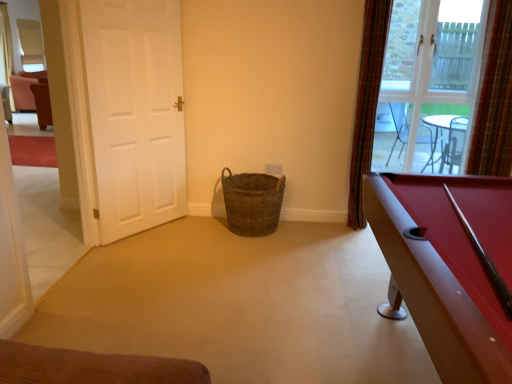
The image size is (512, 384). What do you see at coordinates (429, 85) in the screenshot?
I see `clear glass window at upper right` at bounding box center [429, 85].

Where is `white matte door at left`? The image size is (512, 384). white matte door at left is located at coordinates tap(130, 116).

Where is `plaid fabric curtain at upper right, the first curtain viewed from the right`? The width and height of the screenshot is (512, 384). plaid fabric curtain at upper right, the first curtain viewed from the right is located at coordinates (494, 98).

This screenshot has height=384, width=512. Identify the location of clear glass window at upper right. (429, 85).

Is white matte door at left positioned beyond the bounds of brown woven basket at center?

Yes, white matte door at left is outside of brown woven basket at center.

Considering the sizes of objects white matte door at left and brown woven basket at center in the image provided, who is bigger, white matte door at left or brown woven basket at center?

Bigger between the two is white matte door at left.

Would you say white matte door at left is a long distance from brown woven basket at center?

No, white matte door at left is in close proximity to brown woven basket at center.

Consider the image. In the image, is white matte door at left on the left side or the right side of plaid fabric curtain at right, which appears as the 1th curtain when viewed from the left?

white matte door at left is positioned on plaid fabric curtain at right, which appears as the 1th curtain when viewed from the left,'s left side.

Between white matte door at left and plaid fabric curtain at right, which appears as the 1th curtain when viewed from the left, which one has more height?

plaid fabric curtain at right, which appears as the 1th curtain when viewed from the left, is taller.

From a real-world perspective, is white matte door at left physically above plaid fabric curtain at right, which is counted as the 2th curtain, starting from the right?

No, from a real-world perspective, white matte door at left is not on top of plaid fabric curtain at right, which is counted as the 2th curtain, starting from the right.

Is white matte door at left in front of plaid fabric curtain at right, which appears as the 1th curtain when viewed from the left?

Yes, white matte door at left is in front of plaid fabric curtain at right, which appears as the 1th curtain when viewed from the left.

Is plaid fabric curtain at right, which appears as the 1th curtain when viewed from the left, oriented away from rubberized red pool table at right?

plaid fabric curtain at right, which appears as the 1th curtain when viewed from the left, does not have its back to rubberized red pool table at right.

Which object is more forward, plaid fabric curtain at right, which is counted as the 2th curtain, starting from the right, or rubberized red pool table at right?

rubberized red pool table at right is closer to the camera.

Is white matte door at left to the left of rubberized red pool table at right from the viewer's perspective?

Correct, you'll find white matte door at left to the left of rubberized red pool table at right.

What's the angular difference between white matte door at left and rubberized red pool table at right's facing directions?

white matte door at left and rubberized red pool table at right are facing 147 degrees away from each other.

Which is in front, white matte door at left or rubberized red pool table at right?

Positioned in front is rubberized red pool table at right.

Consider the image. Is white matte door at left inside the boundaries of rubberized red pool table at right, or outside?

The correct answer is: outside.

Looking at this image, does rubberized red pool table at right have a smaller size compared to clear glass window at upper right?

Incorrect, rubberized red pool table at right is not smaller in size than clear glass window at upper right.

Between rubberized red pool table at right and clear glass window at upper right, which one appears on the right side from the viewer's perspective?

From the viewer's perspective, clear glass window at upper right appears more on the right side.

Considering the relative sizes of rubberized red pool table at right and clear glass window at upper right in the image provided, is rubberized red pool table at right shorter than clear glass window at upper right?

Yes, rubberized red pool table at right is shorter than clear glass window at upper right.

Can you tell me how much rubberized red pool table at right and clear glass window at upper right differ in facing direction?

89.9 degrees separate the facing orientations of rubberized red pool table at right and clear glass window at upper right.

From a real-world perspective, which object stands above the other?

rubberized red pool table at right.

Image resolution: width=512 pixels, height=384 pixels. I want to click on basket that appears below the rubberized red pool table at right (from a real-world perspective), so click(x=252, y=202).

Which is in front, point (231, 187) or point (508, 328)?

The point (508, 328) is in front.

Is brown woven basket at center spatially inside rubberized red pool table at right, or outside of it?

brown woven basket at center lies outside rubberized red pool table at right.

Consider the image. From a real-world perspective, is clear glass window at upper right physically above white matte door at left?

Yes, from a real-world perspective, clear glass window at upper right is over white matte door at left

Is point (449, 4) farther from viewer compared to point (102, 170)?

Yes.

Does clear glass window at upper right appear on the left side of white matte door at left?

Incorrect, clear glass window at upper right is not on the left side of white matte door at left.

Is clear glass window at upper right positioned beyond the bounds of white matte door at left?

Yes, clear glass window at upper right is not within white matte door at left.

This screenshot has width=512, height=384. Identify the location of door in front of the brown woven basket at center. (130, 116).

In the image, there is a plaid fabric curtain at right, which appears as the 1th curtain when viewed from the left. Where is `door below it (from the image's perspective)`? door below it (from the image's perspective) is located at coordinates (130, 116).

When comparing their distances from rubberized red pool table at right, does clear glass window at upper right or brown woven basket at center seem closer?

Among the two, brown woven basket at center is located nearer to rubberized red pool table at right.

In the scene shown: Estimate the real-world distances between objects in this image. Which object is further from brown woven basket at center, plaid fabric curtain at upper right, the first curtain viewed from the right, or rubberized red pool table at right?

plaid fabric curtain at upper right, the first curtain viewed from the right, is further to brown woven basket at center.

Which object lies nearer to the anchor point rubberized red pool table at right, brown woven basket at center or plaid fabric curtain at right, which is counted as the 2th curtain, starting from the right?

Based on the image, brown woven basket at center appears to be nearer to rubberized red pool table at right.

Looking at the image, which one is located closer to clear glass window at upper right, white matte door at left or plaid fabric curtain at upper right, the first curtain viewed from the right?

Among the two, plaid fabric curtain at upper right, the first curtain viewed from the right, is located nearer to clear glass window at upper right.

Estimate the real-world distances between objects in this image. Which object is further from plaid fabric curtain at upper right, which is the second curtain from left to right, rubberized red pool table at right or plaid fabric curtain at right, which appears as the 1th curtain when viewed from the left?

rubberized red pool table at right.

Estimate the real-world distances between objects in this image. Which object is further from brown woven basket at center, plaid fabric curtain at upper right, which is the second curtain from left to right, or clear glass window at upper right?

plaid fabric curtain at upper right, which is the second curtain from left to right, is further to brown woven basket at center.

Which object lies nearer to the anchor point plaid fabric curtain at upper right, the first curtain viewed from the right, clear glass window at upper right or brown woven basket at center?

clear glass window at upper right lies closer to plaid fabric curtain at upper right, the first curtain viewed from the right, than the other object.

Based on the photo, which object lies nearer to the anchor point clear glass window at upper right, plaid fabric curtain at upper right, the first curtain viewed from the right, or white matte door at left?

Based on the image, plaid fabric curtain at upper right, the first curtain viewed from the right, appears to be nearer to clear glass window at upper right.

The height and width of the screenshot is (384, 512). I want to click on curtain situated between brown woven basket at center and clear glass window at upper right from left to right, so click(x=367, y=103).

The image size is (512, 384). What are the coordinates of `door between rubberized red pool table at right and plaid fabric curtain at right, which is counted as the 2th curtain, starting from the right, along the z-axis` in the screenshot? It's located at (130, 116).

Image resolution: width=512 pixels, height=384 pixels. Identify the location of window screen between brown woven basket at center and plaid fabric curtain at upper right, the first curtain viewed from the right, in the horizontal direction. (429, 85).

Where is `basket between white matte door at left and clear glass window at upper right`? Image resolution: width=512 pixels, height=384 pixels. basket between white matte door at left and clear glass window at upper right is located at coordinates (252, 202).